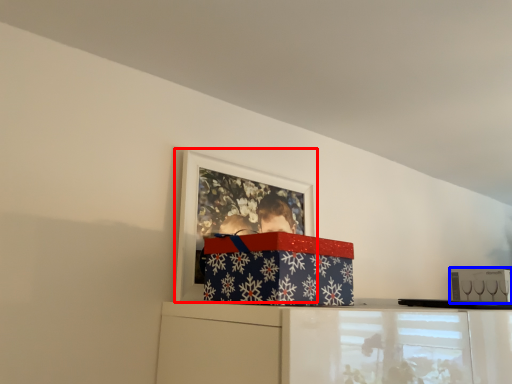
Question: Which object appears closest to the camera in this image, picture frame (highlighted by a red box) or box (highlighted by a blue box)?

Choices:
 (A) picture frame
 (B) box

Answer: (A)